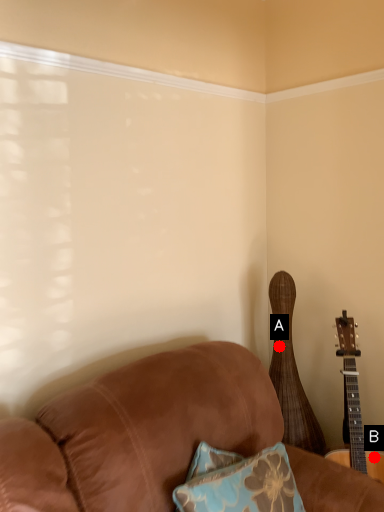
Question: Two points are circled on the image, labeled by A and B beside each circle. Which point appears closest to the camera in this image?

Choices:
 (A) A is closer
 (B) B is closer

Answer: (B)